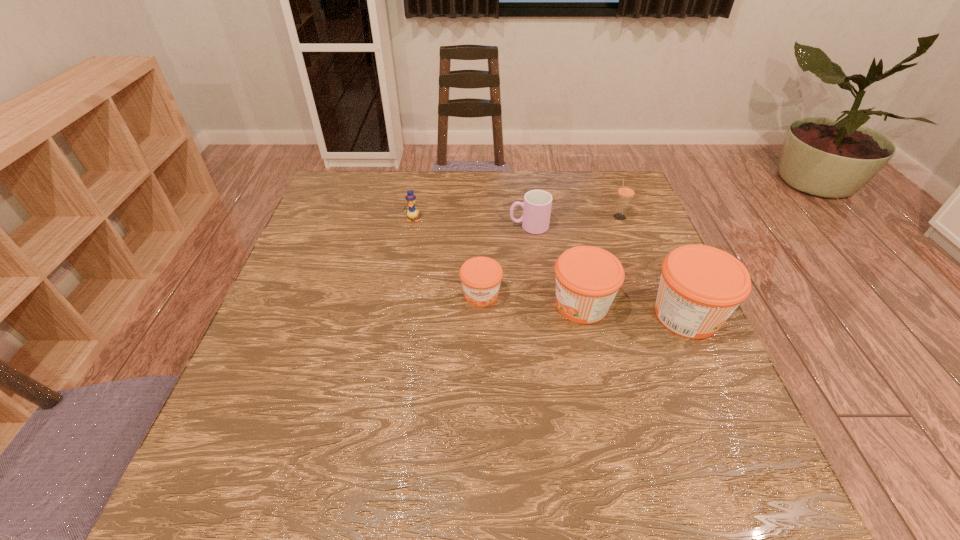
At what (x,y) coordinates should I click in order to perform the action: click on free location located on the front label of the second jam from right to left. Please return your answer as a coordinate pair (x, y). Looking at the image, I should click on (398, 305).

This screenshot has width=960, height=540. I want to click on vacant space located on the face of the leftmost object, where the monocle is placed, so click(x=403, y=268).

Identify the location of free space located with the handle on the side of the cup. (477, 226).

The image size is (960, 540). I want to click on vacant space located 0.060m with the handle on the side of the cup, so click(x=488, y=226).

Where is `free space located 0.400m with the handle on the side of the cup`? The image size is (960, 540). free space located 0.400m with the handle on the side of the cup is located at coordinates (367, 226).

At what (x,y) coordinates should I click in order to perform the action: click on free space located on the left of the straw. Please return your answer as a coordinate pair (x, y). Looking at the image, I should click on (566, 217).

The height and width of the screenshot is (540, 960). In order to click on object that is at the far edge in this screenshot , I will do `click(626, 191)`.

The image size is (960, 540). Find the location of `jam located in the right edge section of the desktop`. jam located in the right edge section of the desktop is located at coordinates (700, 287).

I want to click on straw located at the right edge, so click(626, 191).

The image size is (960, 540). Identify the location of object positioned at the far right corner. (626, 191).